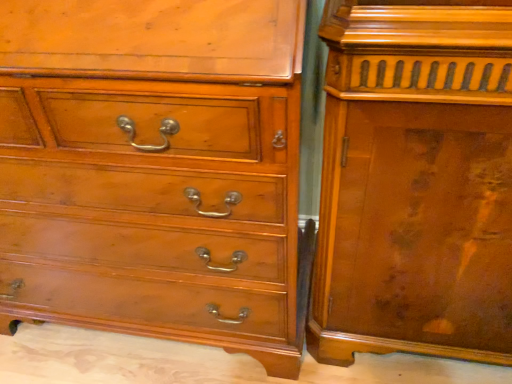
Measure the distance between point (210, 14) and camera.

They are 21.81 inches apart.

Find the location of a particular element. This screenshot has height=384, width=512. matte wood chest of drawers at center is located at coordinates (153, 169).

Measure the distance between matte wood chest of drawers at center and camera.

A distance of 20.91 inches exists between matte wood chest of drawers at center and camera.

Describe the element at coordinates (153, 169) in the screenshot. I see `matte wood chest of drawers at center` at that location.

The width and height of the screenshot is (512, 384). In order to click on matte wood chest of drawers at center in this screenshot , I will do (153, 169).